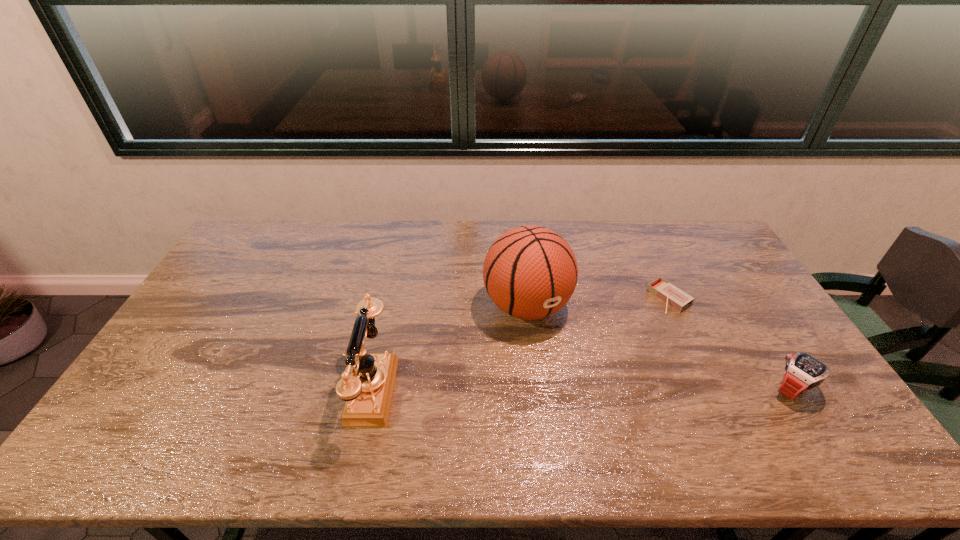
The image size is (960, 540). In order to click on free space on the desktop that is between the third shortest object and the rightmost object and is positioned on the side where the inflation valve is located in this screenshot , I will do `click(584, 389)`.

The height and width of the screenshot is (540, 960). What are the coordinates of `vacant space on the desktop that is between the leftmost object and the watch and is positioned on the striking surface of the matchbox` in the screenshot? It's located at (530, 389).